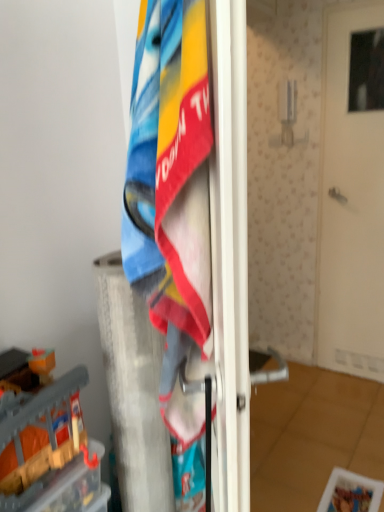
Where is `white textured pillar at center`? Image resolution: width=384 pixels, height=512 pixels. white textured pillar at center is located at coordinates (133, 390).

What do you see at coordinates (352, 194) in the screenshot? I see `white matte door at center` at bounding box center [352, 194].

You are a GUI agent. You are given a task and a screenshot of the screen. Output one action in this format:
    pyautogui.click(x=<x>, y=<y>)
    Task: Click on the wooden block at left
    This screenshot has width=384, height=512.
    Given the screenshot: What is the action you would take?
    pyautogui.click(x=46, y=442)

Where is `textured cotton towel at center`? This screenshot has height=512, width=384. textured cotton towel at center is located at coordinates (171, 190).

Is white textured pillar at center aimed at wooden block at left?

No, white textured pillar at center is not oriented towards wooden block at left.

Which of these two, white textured pillar at center or wooden block at left, is thinner?

With smaller width is white textured pillar at center.

Considering the points (139, 343) and (59, 461), which point is behind, point (139, 343) or point (59, 461)?

The point (139, 343) is farther.

From the image's perspective, who appears lower, white textured pillar at center or wooden block at left?

white textured pillar at center.

Is wooden block at left facing away from white matte door at center?

That's not correct — wooden block at left is not looking away from white matte door at center.

Locate an element on the screen. The width and height of the screenshot is (384, 512). door behind the wooden block at left is located at coordinates (352, 194).

Does wooden block at left have a lesser height compared to white matte door at center?

Correct, wooden block at left is not as tall as white matte door at center.

Considering the positions of point (123, 309) and point (206, 121), is point (123, 309) closer or farther from the camera than point (206, 121)?

Point (123, 309) is farther from the camera than point (206, 121).

Find the location of a particular element. The width and height of the screenshot is (384, 512). towel on the right of white textured pillar at center is located at coordinates (171, 190).

Are white textured pillar at center and textured cotton towel at center far apart?

No, white textured pillar at center is in close proximity to textured cotton towel at center.

From a real-world perspective, which is physically below, white matte door at center or white textured pillar at center?

white textured pillar at center.

Identify the location of door behind the white textured pillar at center. (352, 194).

Is white matte door at center oriented towards white textured pillar at center?

Yes, white matte door at center faces towards white textured pillar at center.

In terms of height, does textured cotton towel at center look taller or shorter compared to white matte door at center?

textured cotton towel at center is shorter than white matte door at center.

Find the location of a particular element. Image resolution: width=384 pixels, height=512 pixels. towel on the left of white matte door at center is located at coordinates (171, 190).

From the picture: What's the angular difference between textured cotton towel at center and white matte door at center's facing directions?

They differ by 56.4 degrees in their facing directions.

In terms of size, does textured cotton towel at center appear bigger or smaller than white matte door at center?

In the image, textured cotton towel at center appears to be smaller than white matte door at center.

In the scene shown: From the image's perspective, between wooden block at left and textured cotton towel at center, which one is located above?

textured cotton towel at center, from the image's perspective.

Is wooden block at left bigger or smaller than textured cotton towel at center?

wooden block at left is smaller than textured cotton towel at center.

Are wooden block at left and textured cotton towel at center located far from each other?

No, wooden block at left is in close proximity to textured cotton towel at center.

Is wooden block at left behind textured cotton towel at center?

Yes.

From the image's perspective, is textured cotton towel at center under white textured pillar at center?

No, from the image's perspective, textured cotton towel at center is not beneath white textured pillar at center.

Which point is more distant from viewer, [200,70] or [146,342]?

The point [146,342] is more distant.

The width and height of the screenshot is (384, 512). In order to click on pillar on the right side of wooden block at left in this screenshot , I will do `click(133, 390)`.

This screenshot has width=384, height=512. Identify the location of toy below the white matte door at center (from the image's perspective). (46, 442).

From the image, which object appears to be farther from white matte door at center, textured cotton towel at center or white textured pillar at center?

textured cotton towel at center is positioned further to the anchor white matte door at center.

Which object lies further to the anchor point wooden block at left, white matte door at center or textured cotton towel at center?

The object further to wooden block at left is white matte door at center.

Looking at the image, which one is located closer to textured cotton towel at center, wooden block at left or white textured pillar at center?

Based on the image, wooden block at left appears to be nearer to textured cotton towel at center.

Based on their spatial positions, is white textured pillar at center or textured cotton towel at center closer to white matte door at center?

white textured pillar at center is positioned closer to the anchor white matte door at center.

Based on their spatial positions, is white matte door at center or white textured pillar at center closer to wooden block at left?

Based on the image, white textured pillar at center appears to be nearer to wooden block at left.

When comparing their distances from wooden block at left, does white textured pillar at center or textured cotton towel at center seem closer?

white textured pillar at center.

From the image, which object appears to be nearer to white matte door at center, wooden block at left or textured cotton towel at center?

Based on the image, wooden block at left appears to be nearer to white matte door at center.

Considering their positions, is white textured pillar at center positioned further to textured cotton towel at center than wooden block at left?

white textured pillar at center.

In order to click on pillar between textured cotton towel at center and white matte door at center from front to back in this screenshot , I will do `click(133, 390)`.

Locate an element on the screen. The height and width of the screenshot is (512, 384). toy between textured cotton towel at center and white textured pillar at center in the front-back direction is located at coordinates (46, 442).

I want to click on pillar located between wooden block at left and white matte door at center in the left-right direction, so click(x=133, y=390).

Where is `toy located between textured cotton towel at center and white matte door at center in the depth direction`? Image resolution: width=384 pixels, height=512 pixels. toy located between textured cotton towel at center and white matte door at center in the depth direction is located at coordinates (46, 442).